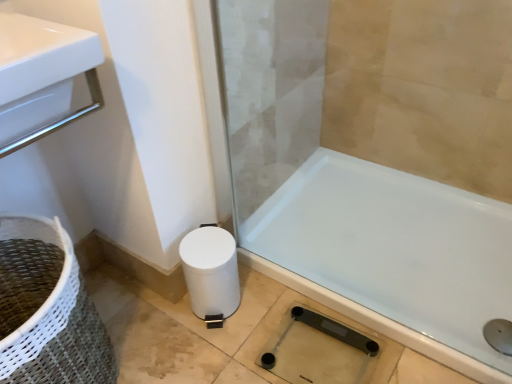
The image size is (512, 384). I want to click on free spot below transparent glass shower at lower right (from a real-world perspective), so click(x=311, y=343).